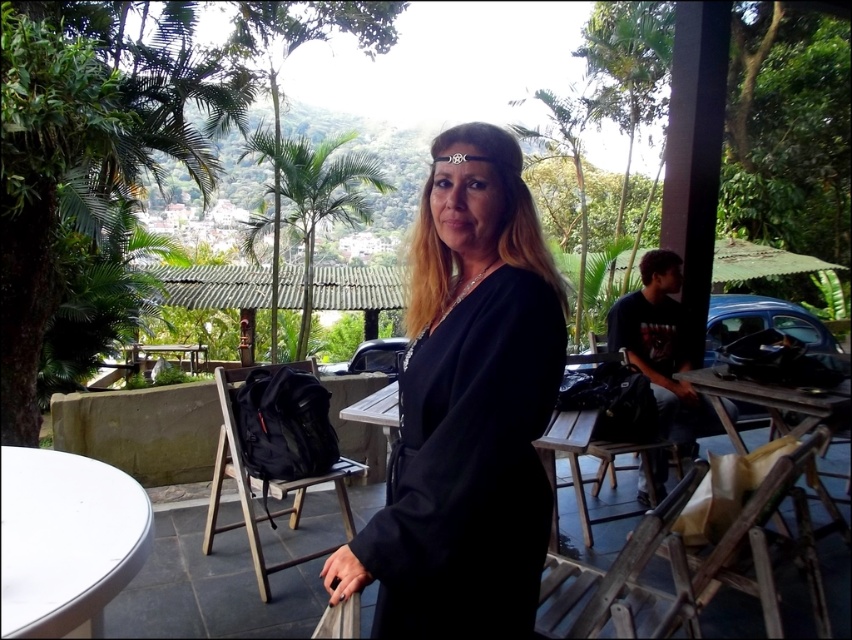
Question: Which of the following is the closest to the observer?

Choices:
 (A) (735, 445)
 (B) (655, 529)
 (C) (72, 548)

Answer: (C)

Question: Which point is farther to the camera?

Choices:
 (A) (602, 576)
 (B) (626, 512)
 (C) (796, 470)
 (D) (117, 499)

Answer: (B)

Question: Is black matte dress at center positioned behind wooden table at lower right?

Choices:
 (A) no
 (B) yes

Answer: (A)

Question: Which object is closer to the camera taking this photo?

Choices:
 (A) wooden table at lower right
 (B) wooden chair at lower center
 (C) wooden chair at right

Answer: (B)

Question: Is black matte dress at center bigger than black fabric chair at lower left?

Choices:
 (A) no
 (B) yes

Answer: (A)

Question: Is black matte dress at center closer to the viewer compared to white plastic table at lower left?

Choices:
 (A) no
 (B) yes

Answer: (B)